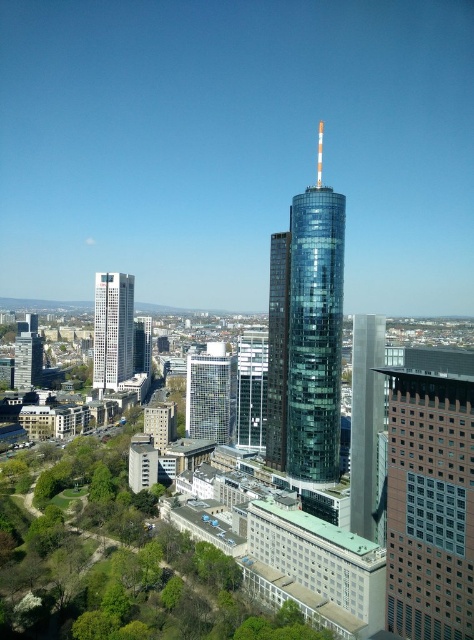
Is transparent glass tower at center to the right of glassy steel skyscraper at center from the viewer's perspective?

Indeed, transparent glass tower at center is positioned on the right side of glassy steel skyscraper at center.

Who is positioned more to the right, transparent glass tower at center or glassy steel skyscraper at center?

transparent glass tower at center

Identify the location of transparent glass tower at center. This screenshot has width=474, height=640. (306, 333).

Who is positioned more to the right, transparent glass tower at center or clear glass building at center?

transparent glass tower at center

Is transparent glass tower at center wider than clear glass building at center?

Indeed, transparent glass tower at center has a greater width compared to clear glass building at center.

The height and width of the screenshot is (640, 474). Describe the element at coordinates (306, 333) in the screenshot. I see `transparent glass tower at center` at that location.

The image size is (474, 640). Identify the location of transparent glass tower at center. (306, 333).

Does point (355, 416) lie in front of point (109, 371)?

Yes.

This screenshot has width=474, height=640. What are the coordinates of `glassy steel skyscraper at center` in the screenshot? It's located at (365, 420).

At what (x,y) coordinates should I click in order to perform the action: click on glassy steel skyscraper at center. Please return your answer as a coordinate pair (x, y). The width and height of the screenshot is (474, 640). Looking at the image, I should click on (365, 420).